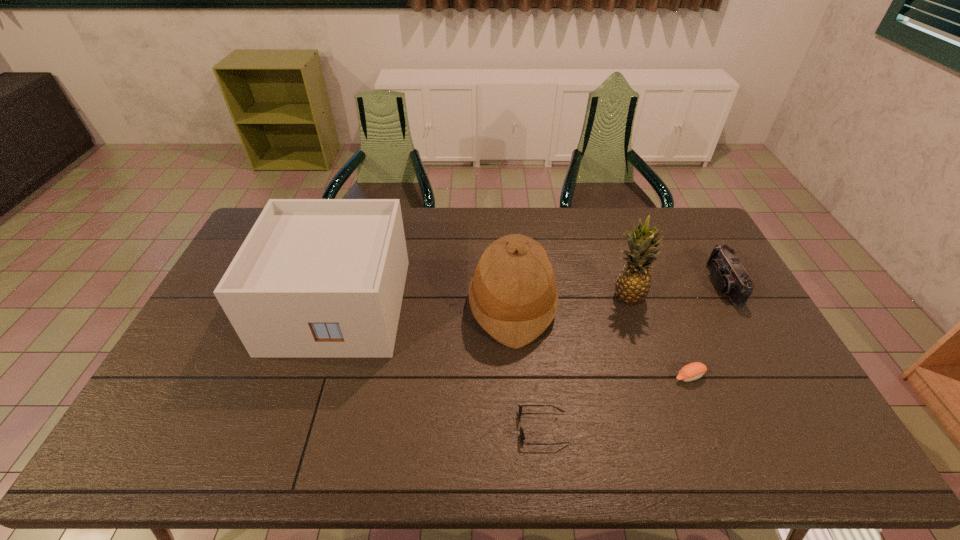
Locate an element on the screen. The width and height of the screenshot is (960, 540). vacant space that satisfies the following two spatial constraints: 1. on the front-facing side of the hat; 2. on the side of the leftmost object with the window is located at coordinates (513, 306).